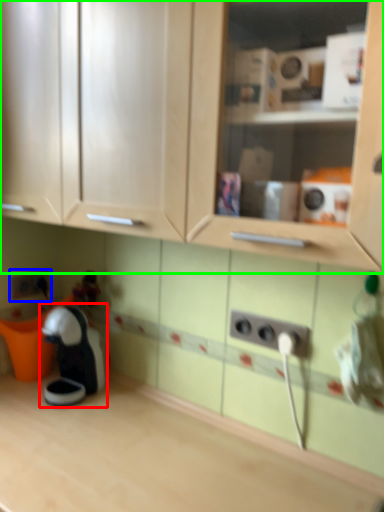
Question: Which object is positioned closest to toy (highlighted by a red box)? Select from electric outlet (highlighted by a blue box) and cabinetry (highlighted by a green box).

Choices:
 (A) electric outlet
 (B) cabinetry

Answer: (A)